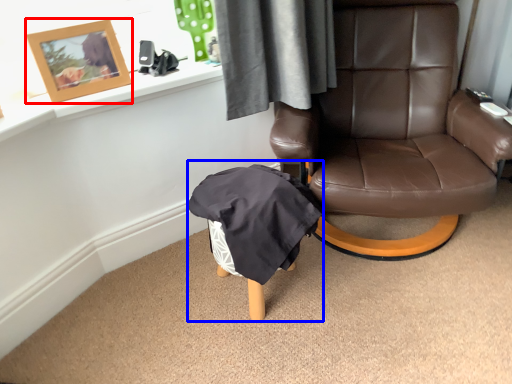
Question: Which point is closer to the camera, picture frame (highlighted by a red box) or bean bag chair (highlighted by a blue box)?

Choices:
 (A) picture frame
 (B) bean bag chair

Answer: (B)